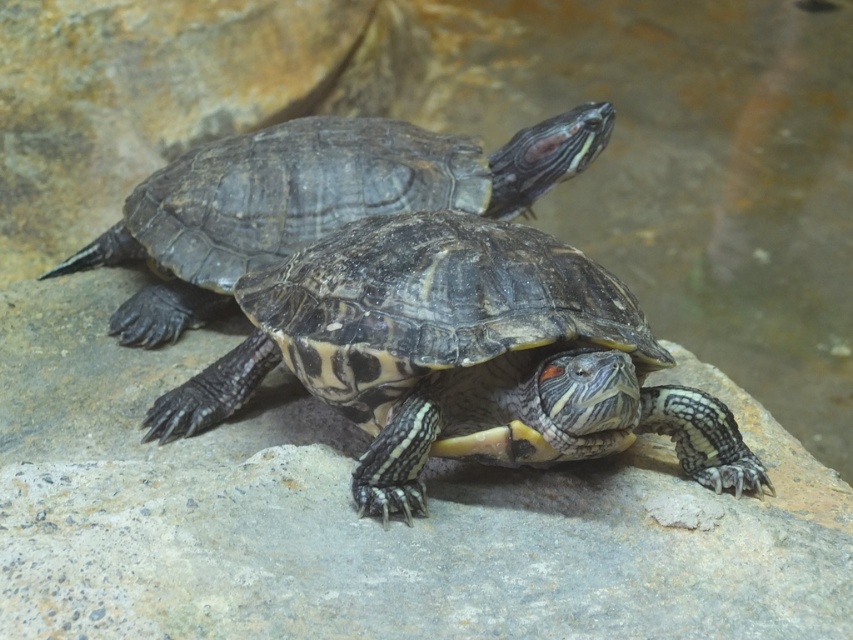
You are a wildlife photographer aiming to capture a closeup of both the patterned shell turtle at center and the shiny dark tortoise at center. Since you want the turtle closer to you to be in focus, which turtle should you focus on?

You should focus on the patterned shell turtle at center because it is closer to the viewer than the shiny dark tortoise at center.

From the picture: You are a wildlife photographer aiming to capture a clear photo of both the patterned shell turtle at center and the shiny dark tortoise at center. Since the turtles are positioned close together, which turtle should you focus on to ensure the other is also in the frame?

The patterned shell turtle at center is below the shiny dark tortoise at center. By focusing on the shiny dark tortoise at center, you can ensure the patterned shell turtle at center is also in the frame since it is positioned below it.